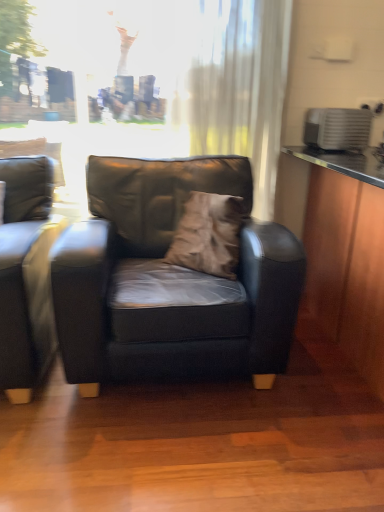
Question: Considering their positions, is matte black chair at center located in front of or behind matte black couch at left?

Choices:
 (A) behind
 (B) front

Answer: (A)

Question: Do you think matte black chair at center is within matte black couch at left, or outside of it?

Choices:
 (A) outside
 (B) inside

Answer: (A)

Question: Estimate the real-world distances between objects in this image. Which object is closer to the brown suede pillow at center?

Choices:
 (A) matte black chair at center
 (B) matte black couch at left
 (C) white sheer curtain at upper center

Answer: (A)

Question: Which of these objects is positioned closest to the matte black chair at center?

Choices:
 (A) brown suede pillow at center
 (B) white sheer curtain at upper center
 (C) matte black couch at left

Answer: (A)